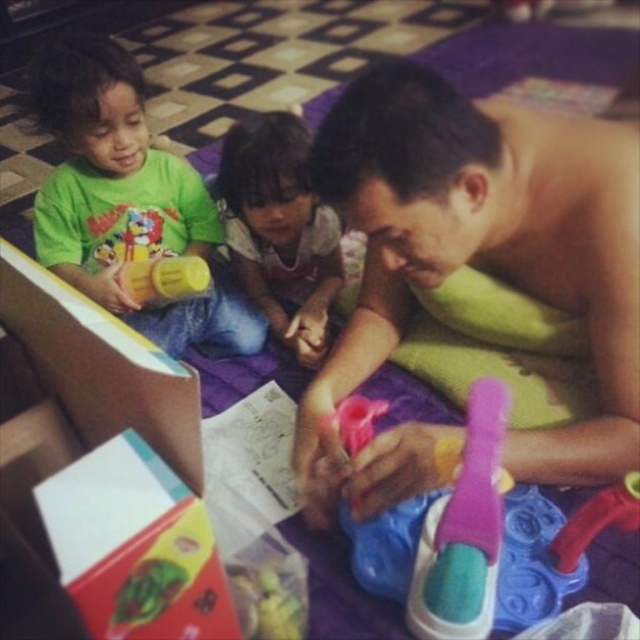
Does point (396, 563) lie in front of point (131, 273)?

That is True.

Does point (369, 545) lie in front of point (189, 264)?

That is True.

The width and height of the screenshot is (640, 640). Find the location of `pink plastic toy at center`. pink plastic toy at center is located at coordinates (468, 544).

Based on the photo, is matte white shirt at center above pink rubber toothbrush at center?

Correct, matte white shirt at center is located above pink rubber toothbrush at center.

Does matte white shirt at center appear on the right side of pink rubber toothbrush at center?

In fact, matte white shirt at center is to the left of pink rubber toothbrush at center.

Between point (236, 195) and point (499, 420), which one is positioned in front?

Point (499, 420)

This screenshot has width=640, height=640. I want to click on matte white shirt at center, so click(280, 228).

Is pink plastic toy at center closer to camera compared to pink rubber toothbrush at center?

No, pink plastic toy at center is further to the viewer.

Which is in front, point (429, 538) or point (493, 458)?

Point (493, 458) is more forward.

You are a GUI agent. You are given a task and a screenshot of the screen. Output one action in this format:
    pyautogui.click(x=<x>, y=<y>)
    Task: Click on the pink plastic toy at center
    
    Given the screenshot: What is the action you would take?
    pyautogui.click(x=468, y=544)